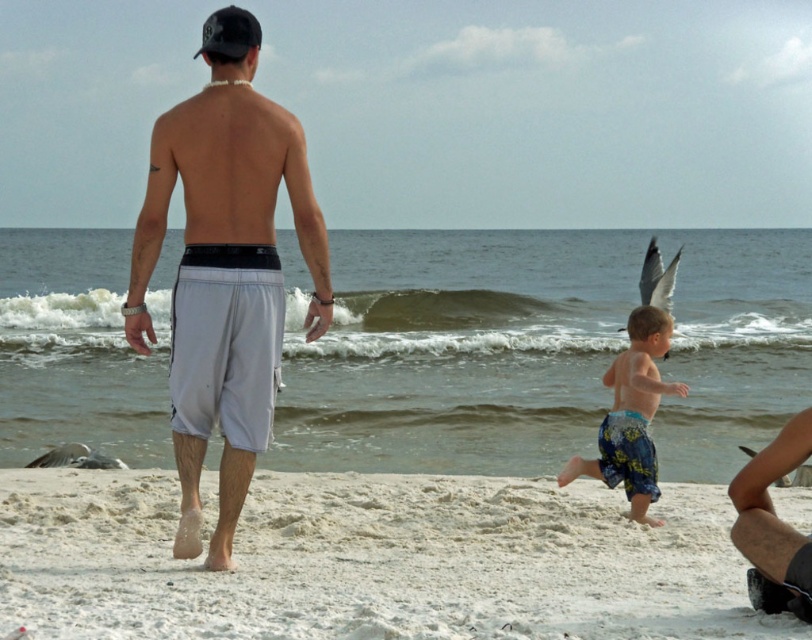
Can you confirm if white sandy beach at lower center is smaller than blue printed shorts at center?

Yes, white sandy beach at lower center is smaller than blue printed shorts at center.

Is point (538, 496) in front of point (646, 353)?

No, it is not.

Which is behind, point (685, 508) or point (646, 381)?

Point (685, 508)

Where is `white sandy beach at lower center`? The height and width of the screenshot is (640, 812). white sandy beach at lower center is located at coordinates (372, 561).

Does white matte shorts at center appear on the left side of blue printed shorts at center?

Indeed, white matte shorts at center is positioned on the left side of blue printed shorts at center.

Who is lower down, white matte shorts at center or blue printed shorts at center?

Positioned lower is blue printed shorts at center.

Who is more distant from viewer, (x=134, y=240) or (x=622, y=358)?

Positioned behind is point (x=622, y=358).

Find the location of a particular element. The height and width of the screenshot is (640, 812). white matte shorts at center is located at coordinates (225, 269).

Is white sandy beach at lower center to the left of white matte shorts at center from the viewer's perspective?

In fact, white sandy beach at lower center is to the right of white matte shorts at center.

Can you confirm if white sandy beach at lower center is bigger than white matte shorts at center?

No, white sandy beach at lower center is not bigger than white matte shorts at center.

Is point (480, 516) positioned before point (223, 381)?

No, (480, 516) is further to viewer.

Locate an element on the screen. white sandy beach at lower center is located at coordinates (372, 561).